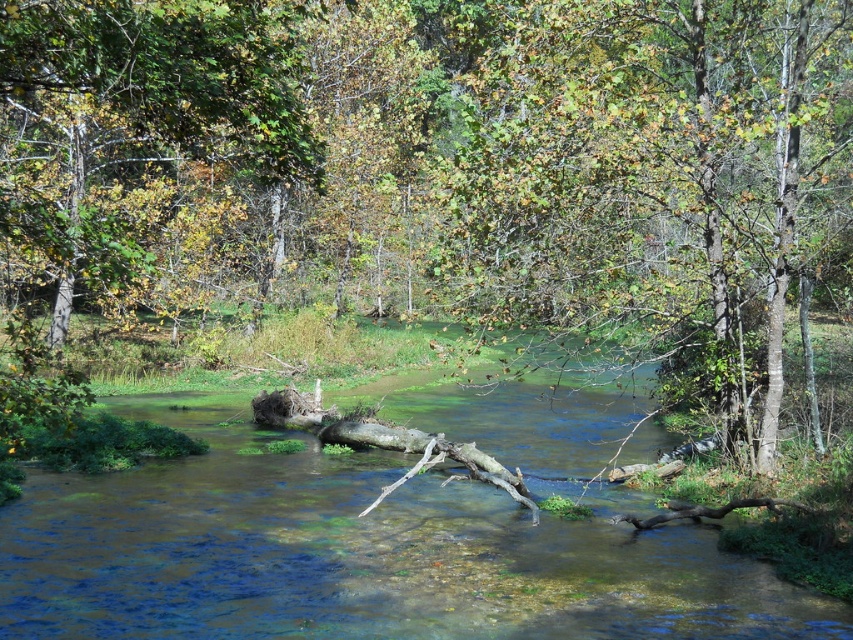
Question: Which point appears closest to the camera in this image?

Choices:
 (A) (519, 307)
 (B) (653, 557)

Answer: (B)

Question: Which point is closer to the camera?

Choices:
 (A) green leafy tree at upper center
 (B) clear water at center

Answer: (B)

Question: Where is clear water at center located in relation to green leafy tree at upper center in the image?

Choices:
 (A) left
 (B) right

Answer: (A)

Question: Is clear water at center thinner than green leafy tree at upper center?

Choices:
 (A) no
 (B) yes

Answer: (A)

Question: Is clear water at center wider than green leafy tree at upper center?

Choices:
 (A) yes
 (B) no

Answer: (A)